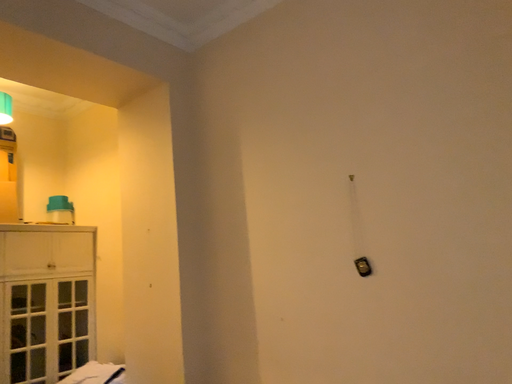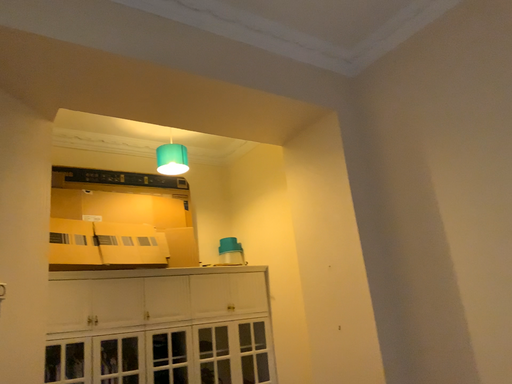
Question: How did the camera likely rotate when shooting the video?

Choices:
 (A) rotated right
 (B) rotated left

Answer: (B)